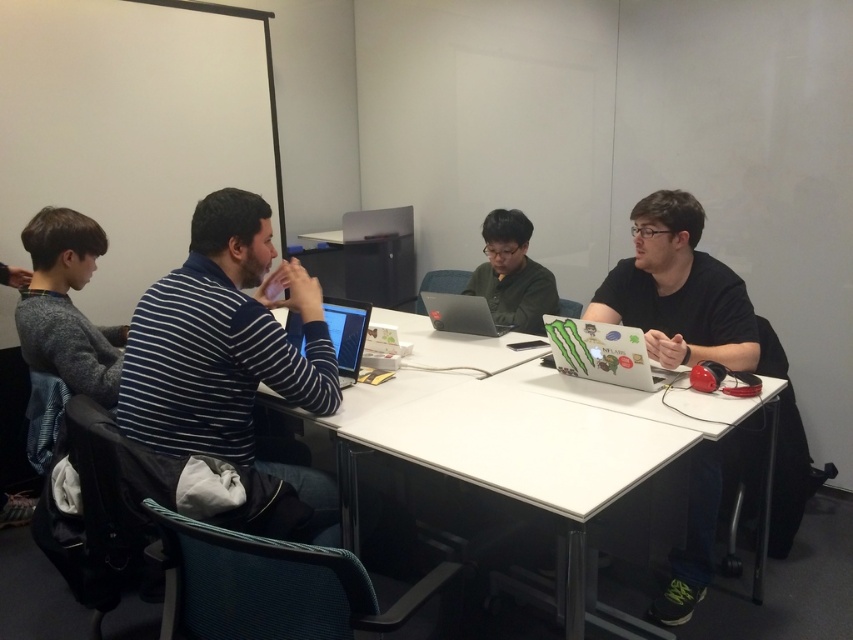
Between blue striped sweater at center and matte green laptop at right, which one is positioned lower?

Positioned lower is blue striped sweater at center.

The image size is (853, 640). What do you see at coordinates (229, 349) in the screenshot? I see `blue striped sweater at center` at bounding box center [229, 349].

Between point (125, 385) and point (633, 362), which one is positioned behind?

Point (633, 362)

Locate an element on the screen. blue striped sweater at center is located at coordinates (229, 349).

Does blue striped sweater at center have a greater height compared to shiny black laptop at center?

Indeed, blue striped sweater at center has a greater height compared to shiny black laptop at center.

Can you confirm if blue striped sweater at center is bigger than shiny black laptop at center?

Indeed, blue striped sweater at center has a larger size compared to shiny black laptop at center.

What do you see at coordinates (229, 349) in the screenshot?
I see `blue striped sweater at center` at bounding box center [229, 349].

Where is `blue striped sweater at center`? Image resolution: width=853 pixels, height=640 pixels. blue striped sweater at center is located at coordinates (229, 349).

Who is positioned more to the left, shiny black laptop at center or matte black laptop at center?

shiny black laptop at center

Can you confirm if shiny black laptop at center is wider than matte black laptop at center?

No, shiny black laptop at center is not wider than matte black laptop at center.

This screenshot has height=640, width=853. Identify the location of shiny black laptop at center. (346, 333).